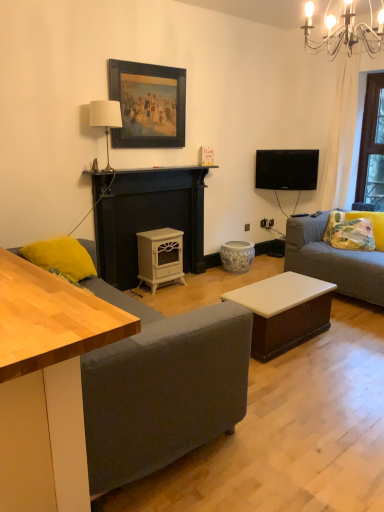
Question: Is black glossy tv at upper right bigger than white glossy coffee table at center?

Choices:
 (A) yes
 (B) no

Answer: (B)

Question: Is black glossy tv at upper right thinner than white glossy coffee table at center?

Choices:
 (A) yes
 (B) no

Answer: (A)

Question: Is black glossy tv at upper right positioned behind white glossy coffee table at center?

Choices:
 (A) yes
 (B) no

Answer: (A)

Question: Is black glossy tv at upper right closer to the viewer compared to white glossy coffee table at center?

Choices:
 (A) yes
 (B) no

Answer: (B)

Question: From a real-world perspective, does black glossy tv at upper right sit lower than white glossy coffee table at center?

Choices:
 (A) yes
 (B) no

Answer: (B)

Question: Could you tell me if black glossy tv at upper right is turned towards white glossy coffee table at center?

Choices:
 (A) yes
 (B) no

Answer: (B)

Question: Considering the relative sizes of floral fabric pillow at right, positioned as the 1th pillow in right-to-left order, and dark gray fabric couch at lower left in the image provided, is floral fabric pillow at right, positioned as the 1th pillow in right-to-left order, wider than dark gray fabric couch at lower left?

Choices:
 (A) yes
 (B) no

Answer: (B)

Question: Is floral fabric pillow at right, which appears as the second pillow when viewed from the front, next to dark gray fabric couch at lower left?

Choices:
 (A) yes
 (B) no

Answer: (B)

Question: Does floral fabric pillow at right, positioned as the 1th pillow in right-to-left order, appear on the right side of dark gray fabric couch at lower left?

Choices:
 (A) no
 (B) yes

Answer: (B)

Question: Can you confirm if floral fabric pillow at right, positioned as the 1th pillow in right-to-left order, is thinner than dark gray fabric couch at lower left?

Choices:
 (A) no
 (B) yes

Answer: (B)

Question: Is floral fabric pillow at right, which appears as the second pillow when viewed from the front, outside dark gray fabric couch at lower left?

Choices:
 (A) no
 (B) yes

Answer: (B)

Question: Is floral fabric pillow at right, arranged as the 1th pillow when viewed from the back, looking in the opposite direction of dark gray fabric couch at lower left?

Choices:
 (A) yes
 (B) no

Answer: (B)

Question: Is light wood desk at left smaller than metallic chandelier at upper right?

Choices:
 (A) yes
 (B) no

Answer: (B)